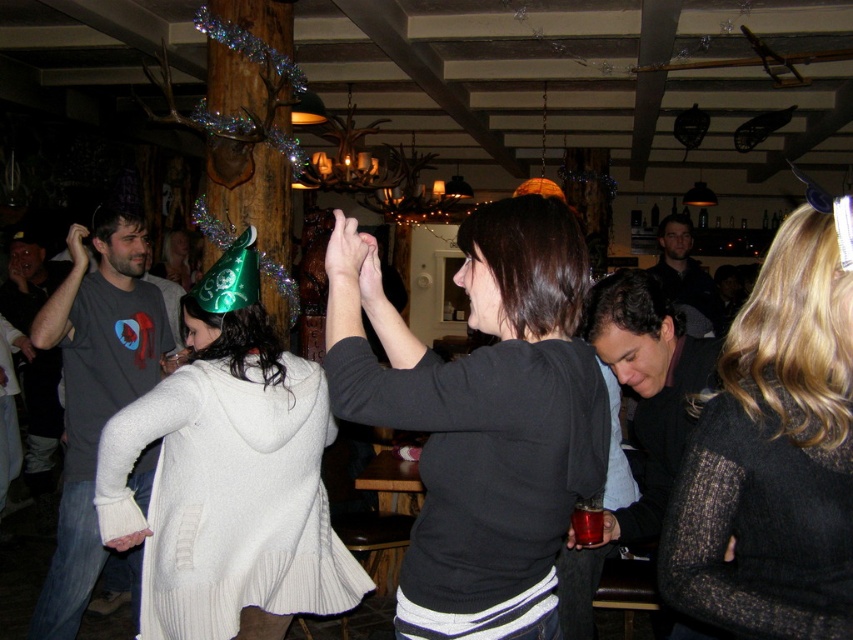
You are standing in the middle of the dance floor at the party. You notice two points marked in the scene. The first point is at coordinate point (235, 604) and the second point is at coordinate point (805, 212). Which of these two points is closer to you?

Point (235, 604) is further to the camera than point (805, 212), so the point closer to you is point (805, 212).

You are at a party and want to hand a drink to the person wearing the black matte sweater at center and the white knitted sweater at center. Which one can you reach first without moving your position?

The black matte sweater at center is closer to the viewer than the white knitted sweater at center, so you can reach the person wearing the black matte sweater at center first.

You are standing at the entrance of the bar and want to find the black matte sweater at center. Based on the coordinates provided, in which direction should you look to locate it?

The black matte sweater at center is located at coordinates point (480, 417), which is to the right and slightly above the center of the image. So you should look towards the right and slightly upwards from the center to find it.